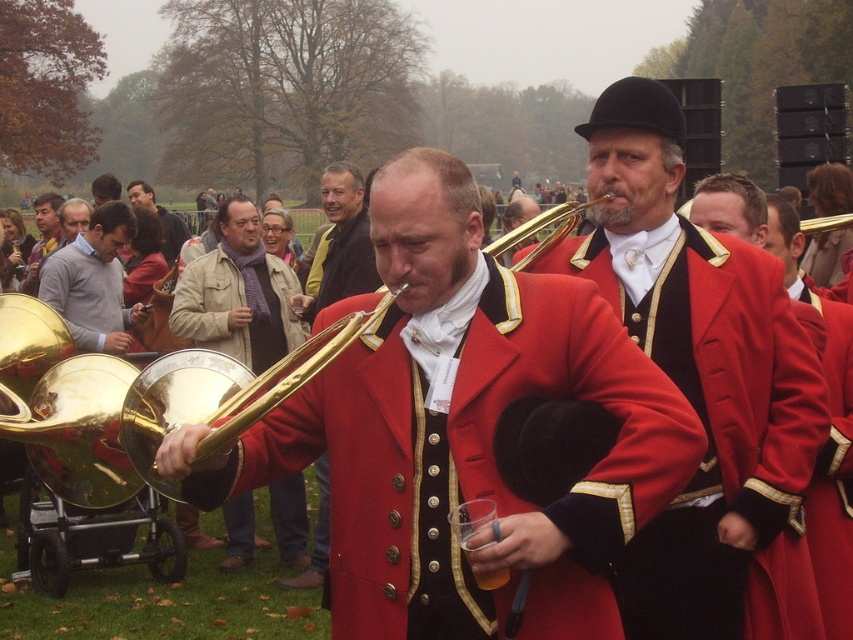
Is point (685, 268) closer to viewer compared to point (90, 339)?

Yes.

Between matte black coat at center and light gray sweater at center, which one is positioned lower?

Positioned lower is matte black coat at center.

Who is more forward, (750, 307) or (51, 288)?

Positioned in front is point (750, 307).

The image size is (853, 640). In order to click on matte black coat at center in this screenshot , I will do `click(704, 387)`.

The image size is (853, 640). What are the coordinates of `light gray sweater at center` in the screenshot? It's located at (93, 282).

Find the location of `light gray sweater at center`. light gray sweater at center is located at coordinates (93, 282).

Is point (260, 388) less distant than point (173, 257)?

Yes, it is.

Is gold brass trumpet at center smaller than matte brown jacket at upper left?

Correct, gold brass trumpet at center occupies less space than matte brown jacket at upper left.

Is point (236, 422) closer to viewer compared to point (172, 244)?

Yes, point (236, 422) is closer to viewer.

This screenshot has width=853, height=640. I want to click on gold brass trumpet at center, so click(286, 376).